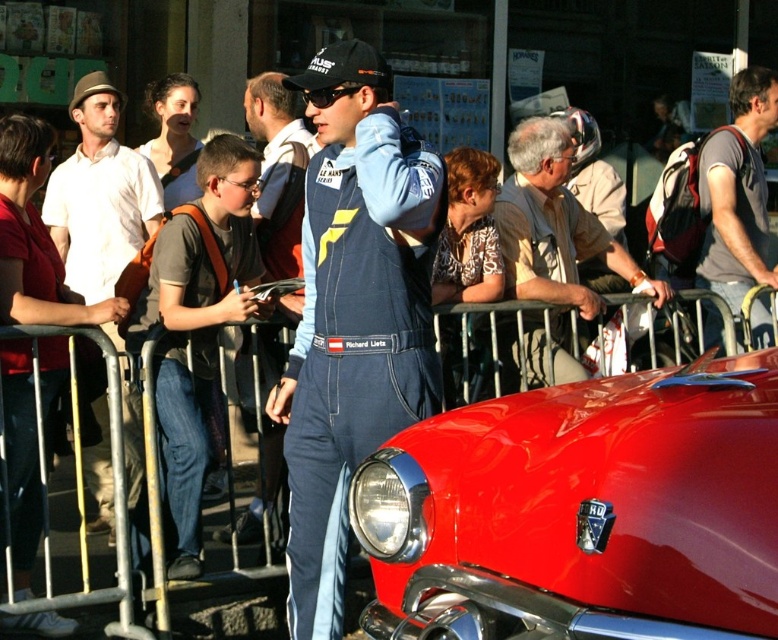
Between point (389, 504) and point (706, 160), which one is positioned in front?

Point (389, 504)

Does shiny red car at center have a greater height compared to gray fabric backpack at right?

No.

Who is more distant from viewer, (619, 636) or (748, 148)?

The point (748, 148) is more distant.

Image resolution: width=778 pixels, height=640 pixels. I want to click on shiny red car at center, so click(582, 509).

Who is higher up, blue denim jumpsuit at center or gray fabric backpack at right?

gray fabric backpack at right

Locate an element on the screen. blue denim jumpsuit at center is located at coordinates (352, 314).

Consider the image. Does shiny red car at center have a larger size compared to matte white shirt at left?

Correct, shiny red car at center is larger in size than matte white shirt at left.

Which of these two, shiny red car at center or matte white shirt at left, stands shorter?

Standing shorter between the two is shiny red car at center.

At what (x,y) coordinates should I click in order to perform the action: click on shiny red car at center. Please return your answer as a coordinate pair (x, y). Looking at the image, I should click on (582, 509).